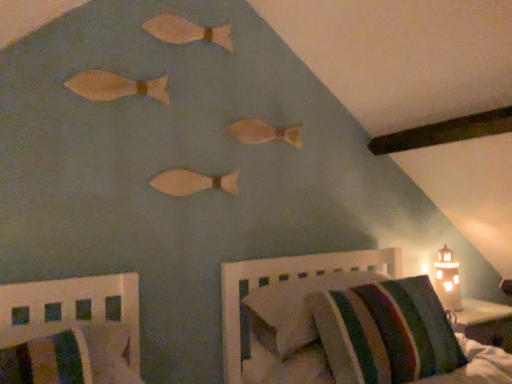
The width and height of the screenshot is (512, 384). What do you see at coordinates (477, 366) in the screenshot?
I see `striped fabric mattress at lower right` at bounding box center [477, 366].

Find the location of a particular element. matte wooden fish at upper left, placed as the second animal when sorted from top to bottom is located at coordinates (115, 86).

Measure the distance between matte wooden fish at upper left, which is counted as the 3th animal, starting from the bottom, and camera.

matte wooden fish at upper left, which is counted as the 3th animal, starting from the bottom, and camera are 5.34 feet apart.

What do you see at coordinates (289, 278) in the screenshot? The image size is (512, 384). I see `wooden lighthouse at right, positioned as the 2th furniture in left-to-right order` at bounding box center [289, 278].

Measure the distance between striped fabric chair at lower left, which ranks as the 1th furniture in left-to-right order, and camera.

4.18 feet.

This screenshot has height=384, width=512. Describe the element at coordinates (295, 308) in the screenshot. I see `striped fabric pillow at lower right` at that location.

Image resolution: width=512 pixels, height=384 pixels. I want to click on striped fabric mattress at lower right, so click(x=477, y=366).

I want to click on the 1st furniture in front of the striped fabric pillow at lower right, so click(289, 278).

From a real-world perspective, who is located lower, striped fabric pillow at lower right or wooden lighthouse at right, positioned as the 2th furniture in left-to-right order?

wooden lighthouse at right, positioned as the 2th furniture in left-to-right order.

Does point (270, 301) lie in front of point (330, 254)?

Yes, it is.

Looking at their sizes, would you say striped fabric pillow at lower right is wider or thinner than wooden lighthouse at right, which appears as the 1th furniture when viewed from the right?

Considering their sizes, striped fabric pillow at lower right looks broader than wooden lighthouse at right, which appears as the 1th furniture when viewed from the right.

Is wooden fish at upper center, placed as the 1th animal when sorted from top to bottom, oriented towards wooden lighthouse at right, which appears as the 1th furniture when viewed from the right?

No, wooden fish at upper center, placed as the 1th animal when sorted from top to bottom, is not facing towards wooden lighthouse at right, which appears as the 1th furniture when viewed from the right.

From the image's perspective, which is below, wooden fish at upper center, placed as the 1th animal when sorted from top to bottom, or wooden lighthouse at right, positioned as the 2th furniture in left-to-right order?

wooden lighthouse at right, positioned as the 2th furniture in left-to-right order, is shown below in the image.

In terms of size, does wooden fish at upper center, placed as the 1th animal when sorted from top to bottom, appear bigger or smaller than wooden lighthouse at right, which appears as the 1th furniture when viewed from the right?

wooden fish at upper center, placed as the 1th animal when sorted from top to bottom, is smaller than wooden lighthouse at right, which appears as the 1th furniture when viewed from the right.

Could you measure the distance between wooden fish at upper center, placed as the 1th animal when sorted from top to bottom, and wooden lighthouse at right, positioned as the 2th furniture in left-to-right order?

They are 3.64 feet apart.

Which of these two, wooden fish at center, the 2th animal ordered from the bottom, or matte wooden fish at center, which appears as the first animal when ordered from the bottom, stands taller?

wooden fish at center, the 2th animal ordered from the bottom, is taller.

Is wooden fish at center, which is the third animal from top to bottom, touching matte wooden fish at center, marked as the 4th animal in a top-to-bottom arrangement?

No, wooden fish at center, which is the third animal from top to bottom, is not next to matte wooden fish at center, marked as the 4th animal in a top-to-bottom arrangement.

Relative to matte wooden fish at center, which appears as the first animal when ordered from the bottom, is wooden fish at center, the 2th animal ordered from the bottom, in front or behind?

Visually, wooden fish at center, the 2th animal ordered from the bottom, is located behind matte wooden fish at center, which appears as the first animal when ordered from the bottom.

From the image's perspective, is wooden fish at center, which is the third animal from top to bottom, positioned above or below matte wooden fish at center, marked as the 4th animal in a top-to-bottom arrangement?

Clearly, from the image's perspective, wooden fish at center, which is the third animal from top to bottom, is above matte wooden fish at center, marked as the 4th animal in a top-to-bottom arrangement.

Is striped fabric chair at lower left, which ranks as the 1th furniture in left-to-right order, to the left or to the right of matte wooden fish at upper left, which is counted as the 3th animal, starting from the bottom, in the image?

From the image, it's evident that striped fabric chair at lower left, which ranks as the 1th furniture in left-to-right order, is to the left of matte wooden fish at upper left, which is counted as the 3th animal, starting from the bottom.

Between striped fabric chair at lower left, arranged as the 2th furniture when viewed from the right, and matte wooden fish at upper left, which is counted as the 3th animal, starting from the bottom, which one has less height?

With less height is matte wooden fish at upper left, which is counted as the 3th animal, starting from the bottom.

At what (x,y) coordinates should I click in order to perform the action: click on the 1st animal to the right of the striped fabric chair at lower left, which ranks as the 1th furniture in left-to-right order, starting your count from the anchor. Please return your answer as a coordinate pair (x, y). Looking at the image, I should click on (115, 86).

Looking at this image, considering the sizes of objects striped fabric chair at lower left, arranged as the 2th furniture when viewed from the right, and matte wooden fish at upper left, which is counted as the 3th animal, starting from the bottom, in the image provided, who is wider, striped fabric chair at lower left, arranged as the 2th furniture when viewed from the right, or matte wooden fish at upper left, which is counted as the 3th animal, starting from the bottom,?

striped fabric chair at lower left, arranged as the 2th furniture when viewed from the right, is wider.

Can you confirm if striped fabric chair at lower left, arranged as the 2th furniture when viewed from the right, is bigger than white ceramic table lamp at lower right?

Correct, striped fabric chair at lower left, arranged as the 2th furniture when viewed from the right, is larger in size than white ceramic table lamp at lower right.

Could you measure the distance between striped fabric chair at lower left, which ranks as the 1th furniture in left-to-right order, and white ceramic table lamp at lower right?

striped fabric chair at lower left, which ranks as the 1th furniture in left-to-right order, is 5.39 feet away from white ceramic table lamp at lower right.

Consider the image. Considering their positions, is striped fabric chair at lower left, arranged as the 2th furniture when viewed from the right, located in front of or behind white ceramic table lamp at lower right?

Visually, striped fabric chair at lower left, arranged as the 2th furniture when viewed from the right, is located in front of white ceramic table lamp at lower right.

From the image's perspective, does striped fabric chair at lower left, which ranks as the 1th furniture in left-to-right order, appear higher than white ceramic table lamp at lower right?

No, from the image's perspective, striped fabric chair at lower left, which ranks as the 1th furniture in left-to-right order, is not over white ceramic table lamp at lower right.

Is wooden fish at center, the 2th animal ordered from the bottom, turned away from wooden lighthouse at right, positioned as the 2th furniture in left-to-right order?

wooden fish at center, the 2th animal ordered from the bottom, does not have its back to wooden lighthouse at right, positioned as the 2th furniture in left-to-right order.

From the image's perspective, is wooden fish at center, which is the third animal from top to bottom, above wooden lighthouse at right, which appears as the 1th furniture when viewed from the right?

Indeed, from the image's perspective, wooden fish at center, which is the third animal from top to bottom, is shown above wooden lighthouse at right, which appears as the 1th furniture when viewed from the right.

Based on the photo, considering the sizes of objects wooden fish at center, the 2th animal ordered from the bottom, and wooden lighthouse at right, positioned as the 2th furniture in left-to-right order, in the image provided, who is bigger, wooden fish at center, the 2th animal ordered from the bottom, or wooden lighthouse at right, positioned as the 2th furniture in left-to-right order,?

Bigger between the two is wooden lighthouse at right, positioned as the 2th furniture in left-to-right order.

Measure the distance between wooden fish at center, which is the third animal from top to bottom, and wooden lighthouse at right, which appears as the 1th furniture when viewed from the right.

They are 25.47 inches apart.

Is matte wooden fish at center, marked as the 4th animal in a top-to-bottom arrangement, beside white ceramic table lamp at lower right?

They are not placed beside each other.

Considering the relative sizes of matte wooden fish at center, which appears as the first animal when ordered from the bottom, and white ceramic table lamp at lower right in the image provided, is matte wooden fish at center, which appears as the first animal when ordered from the bottom, shorter than white ceramic table lamp at lower right?

Answer: Correct, matte wooden fish at center, which appears as the first animal when ordered from the bottom, is not as tall as white ceramic table lamp at lower right.

From a real-world perspective, between matte wooden fish at center, marked as the 4th animal in a top-to-bottom arrangement, and white ceramic table lamp at lower right, who is vertically lower?

white ceramic table lamp at lower right is physically lower.

Looking at their sizes, would you say matte wooden fish at center, marked as the 4th animal in a top-to-bottom arrangement, is wider or thinner than white ceramic table lamp at lower right?

In the image, matte wooden fish at center, marked as the 4th animal in a top-to-bottom arrangement, appears to be more narrow than white ceramic table lamp at lower right.

Find the location of a particular element. The width and height of the screenshot is (512, 384). pillow on the left of wooden lighthouse at right, which appears as the 1th furniture when viewed from the right is located at coordinates (295, 308).

From a real-world perspective, which furniture is the 2nd one underneath the wooden fish at upper center, positioned as the fourth animal in bottom-to-top order? Please provide its 2D coordinates.

[(289, 278)]

From the image, which object appears to be farther from striped fabric mattress at lower right, wooden lighthouse at right, which appears as the 1th furniture when viewed from the right, or wooden fish at center, which is the third animal from top to bottom?

wooden fish at center, which is the third animal from top to bottom, is positioned further to the anchor striped fabric mattress at lower right.

Looking at the image, which one is located further to striped fabric chair at lower left, arranged as the 2th furniture when viewed from the right, striped fabric mattress at lower right or wooden fish at upper center, positioned as the fourth animal in bottom-to-top order?

The object further to striped fabric chair at lower left, arranged as the 2th furniture when viewed from the right, is striped fabric mattress at lower right.

Estimate the real-world distances between objects in this image. Which object is closer to wooden lighthouse at right, positioned as the 2th furniture in left-to-right order, striped fabric mattress at lower right or wooden fish at center, the 2th animal ordered from the bottom?

wooden fish at center, the 2th animal ordered from the bottom, is positioned closer to the anchor wooden lighthouse at right, positioned as the 2th furniture in left-to-right order.

Estimate the real-world distances between objects in this image. Which object is further from striped fabric mattress at lower right, white ceramic table lamp at lower right or wooden fish at upper center, positioned as the fourth animal in bottom-to-top order?

Based on the image, wooden fish at upper center, positioned as the fourth animal in bottom-to-top order, appears to be further to striped fabric mattress at lower right.

In the scene shown: Based on their spatial positions, is matte wooden fish at upper left, which is counted as the 3th animal, starting from the bottom, or wooden lighthouse at right, positioned as the 2th furniture in left-to-right order, further from matte wooden fish at center, which appears as the first animal when ordered from the bottom?

wooden lighthouse at right, positioned as the 2th furniture in left-to-right order, lies further to matte wooden fish at center, which appears as the first animal when ordered from the bottom, than the other object.

Looking at the image, which one is located closer to striped fabric mattress at lower right, matte wooden fish at upper left, which is counted as the 3th animal, starting from the bottom, or striped fabric chair at lower left, arranged as the 2th furniture when viewed from the right?

striped fabric chair at lower left, arranged as the 2th furniture when viewed from the right, is closer to striped fabric mattress at lower right.

Based on their spatial positions, is white ceramic table lamp at lower right or wooden fish at upper center, placed as the 1th animal when sorted from top to bottom, closer to matte wooden fish at center, marked as the 4th animal in a top-to-bottom arrangement?

wooden fish at upper center, placed as the 1th animal when sorted from top to bottom, is closer to matte wooden fish at center, marked as the 4th animal in a top-to-bottom arrangement.

Estimate the real-world distances between objects in this image. Which object is further from wooden fish at upper center, positioned as the fourth animal in bottom-to-top order, wooden lighthouse at right, positioned as the 2th furniture in left-to-right order, or striped fabric pillow at lower right?

Based on the image, striped fabric pillow at lower right appears to be further to wooden fish at upper center, positioned as the fourth animal in bottom-to-top order.

This screenshot has width=512, height=384. Identify the location of pillow between wooden lighthouse at right, positioned as the 2th furniture in left-to-right order, and white ceramic table lamp at lower right, along the z-axis. (295, 308).

In order to click on furniture located between matte wooden fish at upper left, which is counted as the 3th animal, starting from the bottom, and white ceramic table lamp at lower right in the left-right direction in this screenshot , I will do tap(289, 278).

I want to click on furniture between wooden fish at upper center, positioned as the fourth animal in bottom-to-top order, and striped fabric chair at lower left, arranged as the 2th furniture when viewed from the right, vertically, so click(289, 278).

Identify the location of pillow between wooden fish at upper center, positioned as the fourth animal in bottom-to-top order, and striped fabric mattress at lower right in the up-down direction. The width and height of the screenshot is (512, 384). (295, 308).